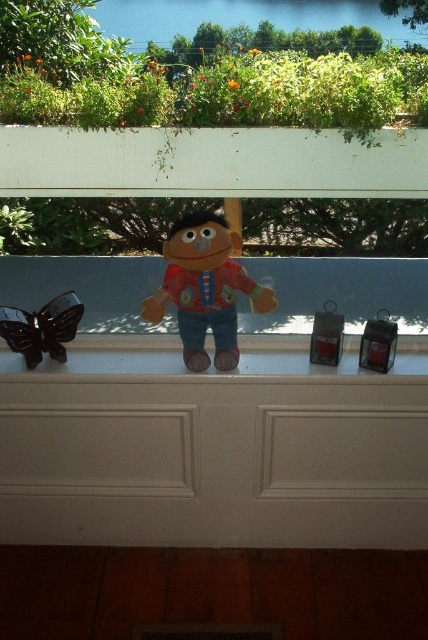
Which of these two, matte brown plush at center or glossy plastic butterfly at left, stands taller?

matte brown plush at center

Is matte brown plush at center to the left of glossy plastic butterfly at left from the viewer's perspective?

In fact, matte brown plush at center is to the right of glossy plastic butterfly at left.

Does point (163, 280) come behind point (62, 340)?

Yes, it is.

The height and width of the screenshot is (640, 428). I want to click on matte brown plush at center, so click(x=205, y=289).

Is white matte ledge at center to the left of glossy plastic butterfly at left from the viewer's perspective?

No, white matte ledge at center is not to the left of glossy plastic butterfly at left.

In order to click on white matte ledge at center in this screenshot , I will do pos(214,452).

Who is positioned more to the left, white matte ledge at center or matte brown plush at center?

From the viewer's perspective, matte brown plush at center appears more on the left side.

Who is shorter, white matte ledge at center or matte brown plush at center?

matte brown plush at center

Does point (323, 545) come farther from viewer compared to point (228, 326)?

Yes, it is.

Where is `white matte ledge at center`? The image size is (428, 640). white matte ledge at center is located at coordinates (214, 452).